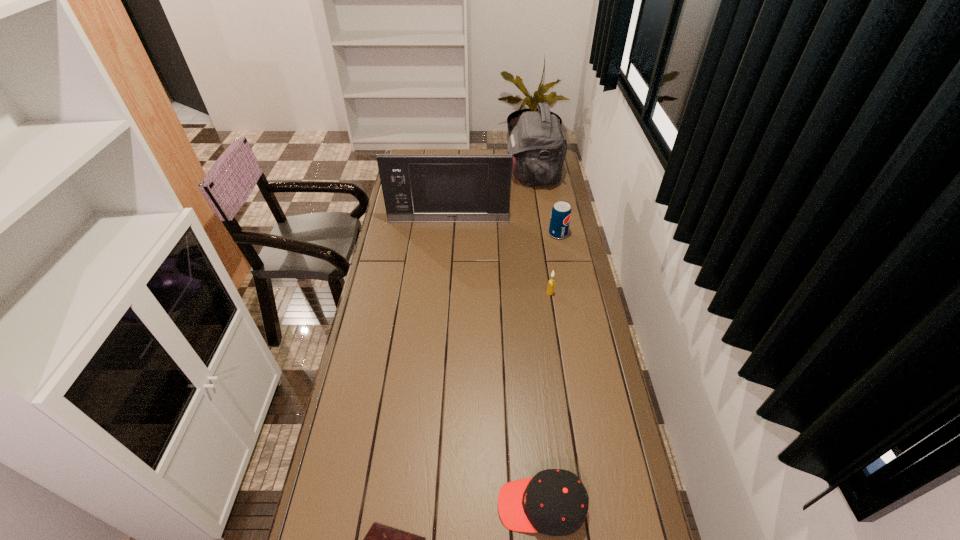
Where is `the farthest object`? the farthest object is located at coordinates (539, 146).

I want to click on the fifth nearest object, so click(470, 188).

Find the location of a particular element. pop is located at coordinates (561, 212).

This screenshot has height=540, width=960. I want to click on the fourth shortest object, so click(x=561, y=212).

Where is `candle`? candle is located at coordinates (551, 283).

The image size is (960, 540). I want to click on cap, so click(x=554, y=502).

I want to click on vacant space situated 0.300m on the open flap of the shoulder bag, so click(x=448, y=176).

The height and width of the screenshot is (540, 960). Identify the location of free space located on the open flap of the shoulder bag. pyautogui.click(x=429, y=176).

Locate an element on the screen. free spot located 0.090m on the open flap of the shoulder bag is located at coordinates (488, 176).

The height and width of the screenshot is (540, 960). I want to click on free point located 0.400m on the front panel of the microwave oven, so click(x=444, y=285).